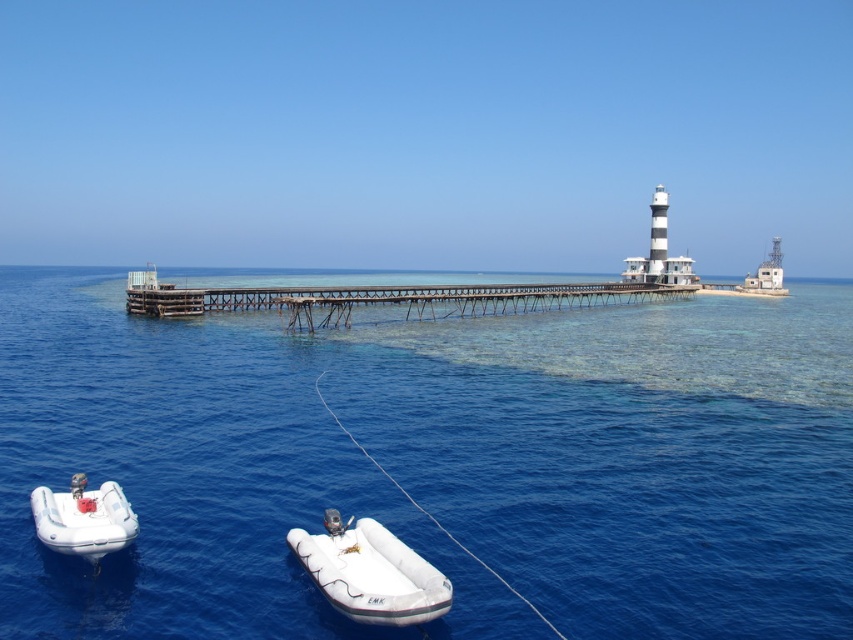
Does point (270, 294) come closer to viewer compared to point (387, 604)?

No.

Is rusty metal dock at center positioned in front of white rubber boat at lower center?

No, rusty metal dock at center is behind white rubber boat at lower center.

Does point (361, 289) lie behind point (358, 586)?

That is True.

I want to click on rusty metal dock at center, so click(x=386, y=298).

Does blue clear water at center appear under rusty metal dock at center?

Yes, blue clear water at center is below rusty metal dock at center.

Is point (462, 388) closer to camera compared to point (172, 304)?

Yes, point (462, 388) is closer to viewer.

At what (x,y) coordinates should I click in order to perform the action: click on blue clear water at center. Please return your answer as a coordinate pair (x, y). This screenshot has height=640, width=853. Looking at the image, I should click on (437, 464).

Measure the distance between white rubber boat at lower center and camera.

white rubber boat at lower center and camera are 20.16 meters apart from each other.

Is point (399, 563) farther from viewer compared to point (49, 538)?

No.

Where is `white rubber boat at lower center`? white rubber boat at lower center is located at coordinates (370, 572).